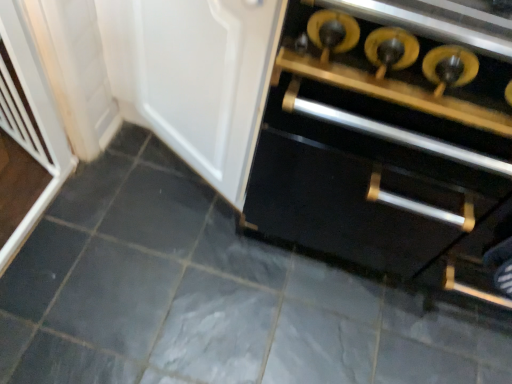
Question: Does gray matte tile at center have a smaller size compared to matte white door at center?

Choices:
 (A) no
 (B) yes

Answer: (B)

Question: Is gray matte tile at center far away from matte white door at center?

Choices:
 (A) no
 (B) yes

Answer: (A)

Question: From the image's perspective, is gray matte tile at center below matte white door at center?

Choices:
 (A) yes
 (B) no

Answer: (A)

Question: Considering the relative sizes of gray matte tile at center and matte white door at center in the image provided, is gray matte tile at center bigger than matte white door at center?

Choices:
 (A) yes
 (B) no

Answer: (B)

Question: Are gray matte tile at center and matte white door at center beside each other?

Choices:
 (A) yes
 (B) no

Answer: (B)

Question: Visually, is white plastic screen door at left positioned to the left or to the right of matte white door at center?

Choices:
 (A) right
 (B) left

Answer: (B)

Question: From the image's perspective, relative to matte white door at center, is white plastic screen door at left above or below?

Choices:
 (A) below
 (B) above

Answer: (A)

Question: Is white plastic screen door at left inside the boundaries of matte white door at center, or outside?

Choices:
 (A) outside
 (B) inside

Answer: (A)

Question: Is point (16, 69) closer or farther from the camera than point (216, 132)?

Choices:
 (A) farther
 (B) closer

Answer: (B)

Question: From the image's perspective, is matte white door at center positioned above or below gray matte tile at center?

Choices:
 (A) above
 (B) below

Answer: (A)

Question: Considering their positions, is matte white door at center located in front of or behind gray matte tile at center?

Choices:
 (A) behind
 (B) front

Answer: (B)

Question: Is matte white door at center taller or shorter than gray matte tile at center?

Choices:
 (A) short
 (B) tall

Answer: (B)

Question: Does point pos(162,59) appear closer or farther from the camera than point pos(65,208)?

Choices:
 (A) farther
 (B) closer

Answer: (B)

Question: Is black matte cabinet at center in front of or behind matte white door at center in the image?

Choices:
 (A) behind
 (B) front

Answer: (B)

Question: From their relative heights in the image, would you say black matte cabinet at center is taller or shorter than matte white door at center?

Choices:
 (A) short
 (B) tall

Answer: (A)